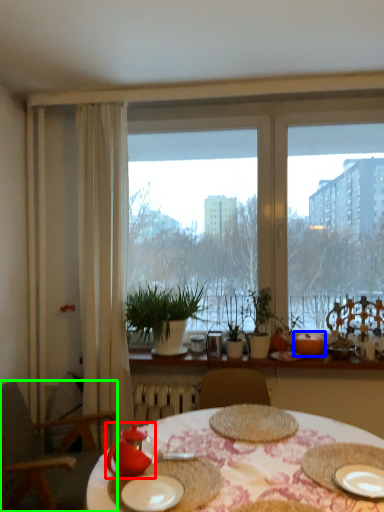
Question: Based on their relative distances, which object is nearer to tableware (highlighted by a red box)? Choose from fruit (highlighted by a blue box) and chair (highlighted by a green box).

Choices:
 (A) fruit
 (B) chair

Answer: (B)